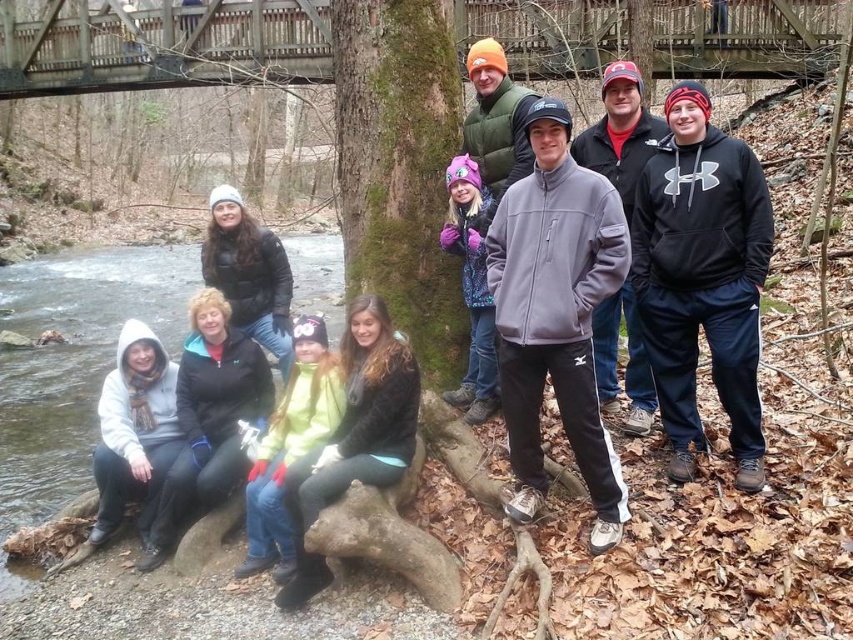
Question: Which object is positioned farthest from the wooden bridge at upper center?

Choices:
 (A) black fleece jacket at center
 (B) green mossy tree trunk at center
 (C) black matte jacket at lower left
 (D) light green fleece at lower left

Answer: (A)

Question: Does green mossy tree trunk at center come behind black fleece jacket at lower left?

Choices:
 (A) yes
 (B) no

Answer: (A)

Question: Which point is closer to the camera?

Choices:
 (A) (115, 4)
 (B) (165, 404)
 (C) (305, 403)

Answer: (C)

Question: Is wooden bridge at upper center positioned before green mossy tree trunk at center?

Choices:
 (A) yes
 (B) no

Answer: (B)

Question: Does light green fleece at lower left have a smaller size compared to black matte jacket at lower left?

Choices:
 (A) no
 (B) yes

Answer: (A)

Question: Which object appears farthest from the camera in this image?

Choices:
 (A) purple fleece jacket at center
 (B) wooden bridge at upper center
 (C) black fleece jacket at lower left
 (D) black fleece jacket at center

Answer: (B)